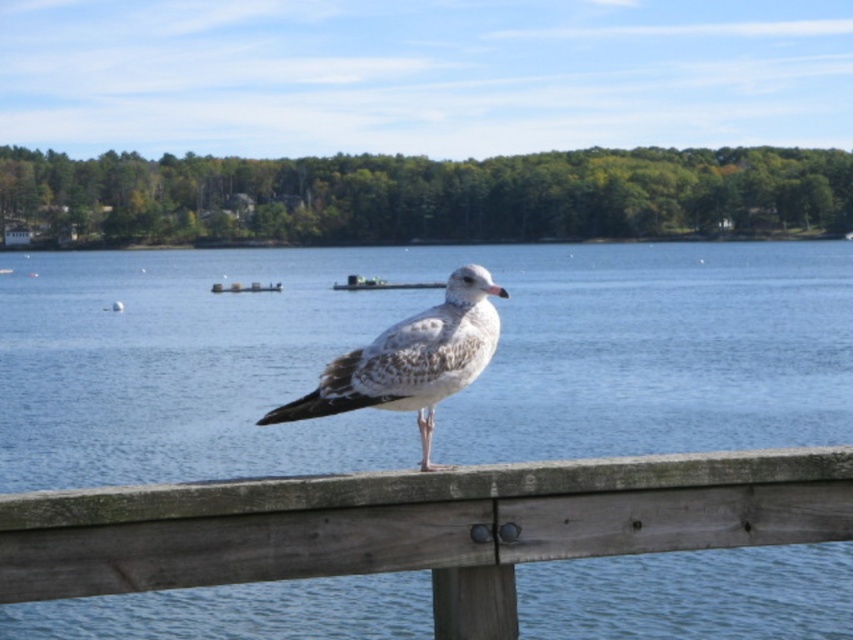
Question: Which object is the closest to the weathered wood rail at center?

Choices:
 (A) blue water at center
 (B) speckled feathered seagull at center

Answer: (B)

Question: Is blue water at center thinner than weathered wood rail at center?

Choices:
 (A) no
 (B) yes

Answer: (A)

Question: Is blue water at center wider than speckled feathered seagull at center?

Choices:
 (A) yes
 (B) no

Answer: (A)

Question: Which point appears closest to the camera in this image?

Choices:
 (A) (247, 445)
 (B) (521, 538)
 (C) (462, 381)

Answer: (B)

Question: Which point appears closest to the camera in this image?

Choices:
 (A) (473, 369)
 (B) (367, 516)

Answer: (B)

Question: Is blue water at center below speckled feathered seagull at center?

Choices:
 (A) yes
 (B) no

Answer: (B)